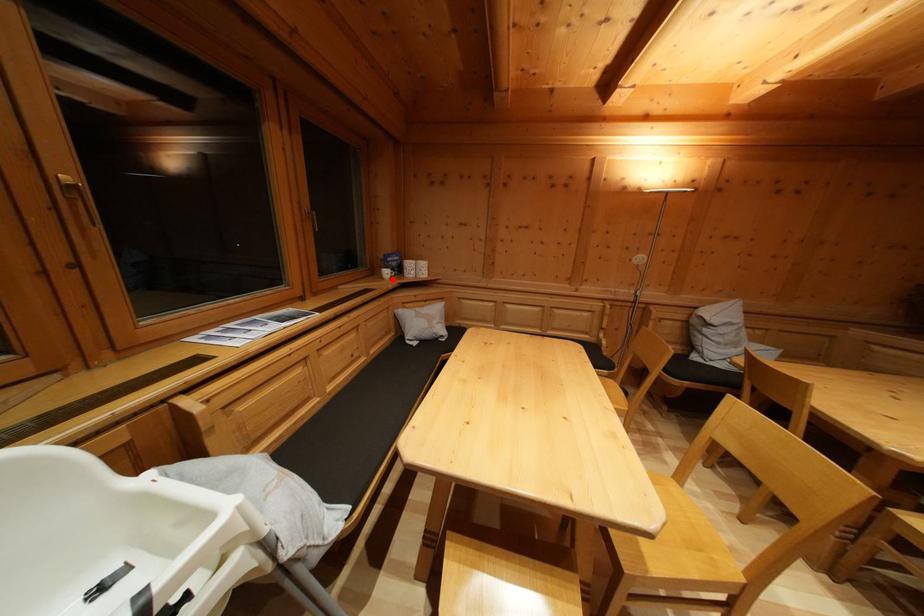
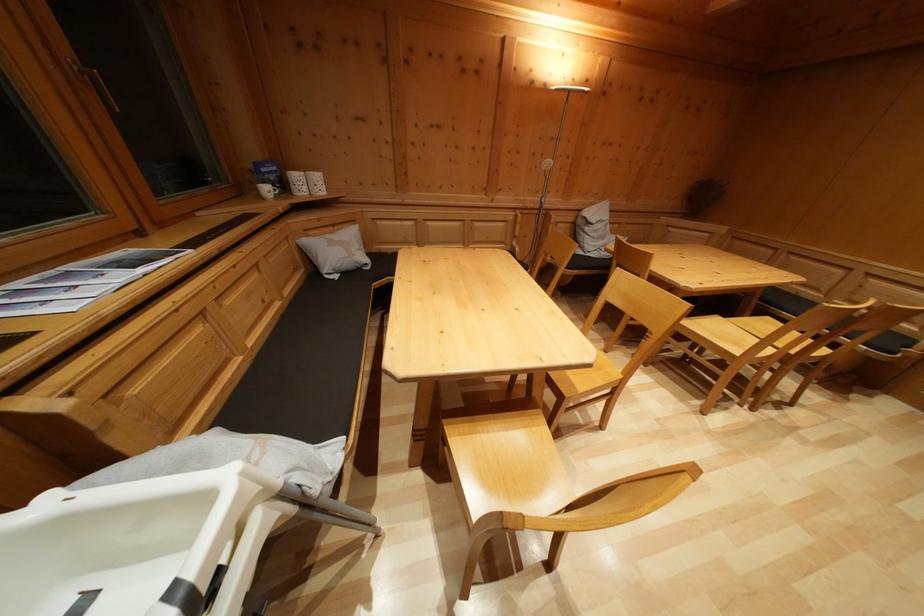
Locate, in the second image, the point that corresponds to the highlighted location in the first image.

(273, 197)